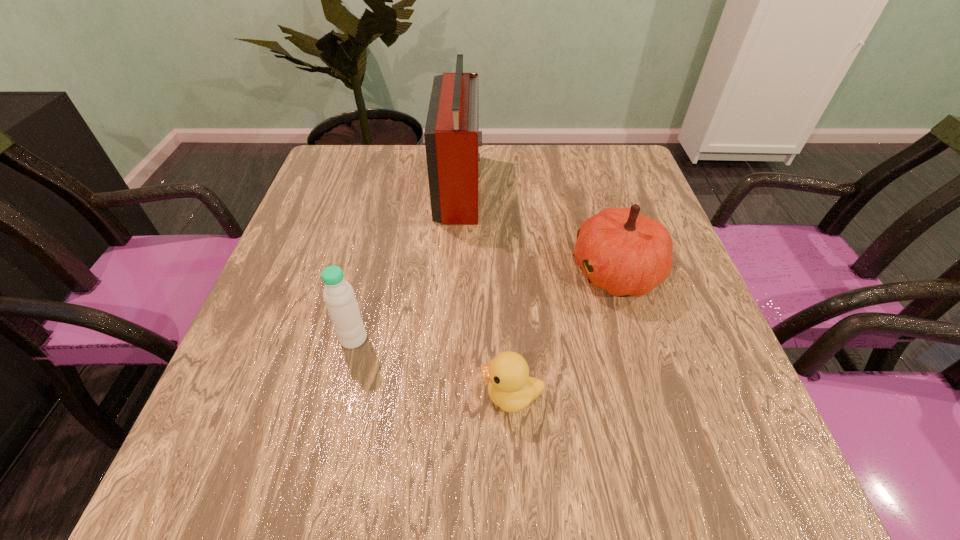
Where is `free space located 0.290m on the front-facing side of the pumpkin`? This screenshot has height=540, width=960. free space located 0.290m on the front-facing side of the pumpkin is located at coordinates (435, 272).

Where is `vacant space located 0.170m on the front-facing side of the pumpkin`? The image size is (960, 540). vacant space located 0.170m on the front-facing side of the pumpkin is located at coordinates (491, 272).

The height and width of the screenshot is (540, 960). Find the location of `vacant space located 0.300m on the front-facing side of the pumpkin`. vacant space located 0.300m on the front-facing side of the pumpkin is located at coordinates (430, 272).

You are a GUI agent. You are given a task and a screenshot of the screen. Output one action in this format:
    pyautogui.click(x=<x>, y=<y>)
    Task: Click on the free space located 0.360m on the face of the shortest object
    
    Given the screenshot: What is the action you would take?
    pyautogui.click(x=267, y=396)

This screenshot has height=540, width=960. Identify the location of free space located on the face of the shortest object. (421, 396).

Identify the location of free space located on the face of the shortest object. (386, 396).

At what (x,y) coordinates should I click in order to perform the action: click on object present at the far edge. Please return your answer as a coordinate pair (x, y). Looking at the image, I should click on (451, 134).

Locate an element on the screen. object present at the right edge is located at coordinates coord(622,251).

The image size is (960, 540). I want to click on vacant space at the far edge of the desktop, so click(566, 171).

Identify the location of vacant region at the near edge of the desktop. The width and height of the screenshot is (960, 540). (501, 461).